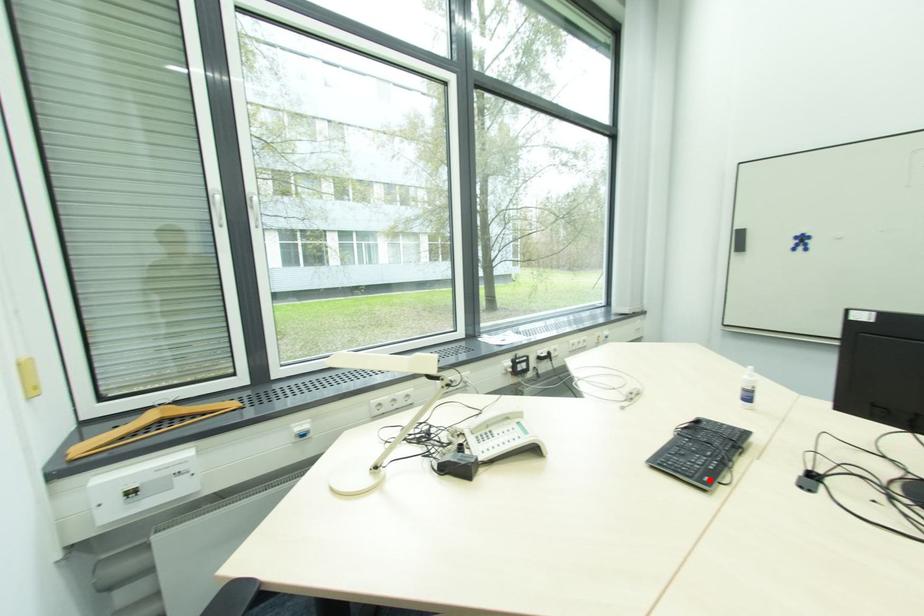
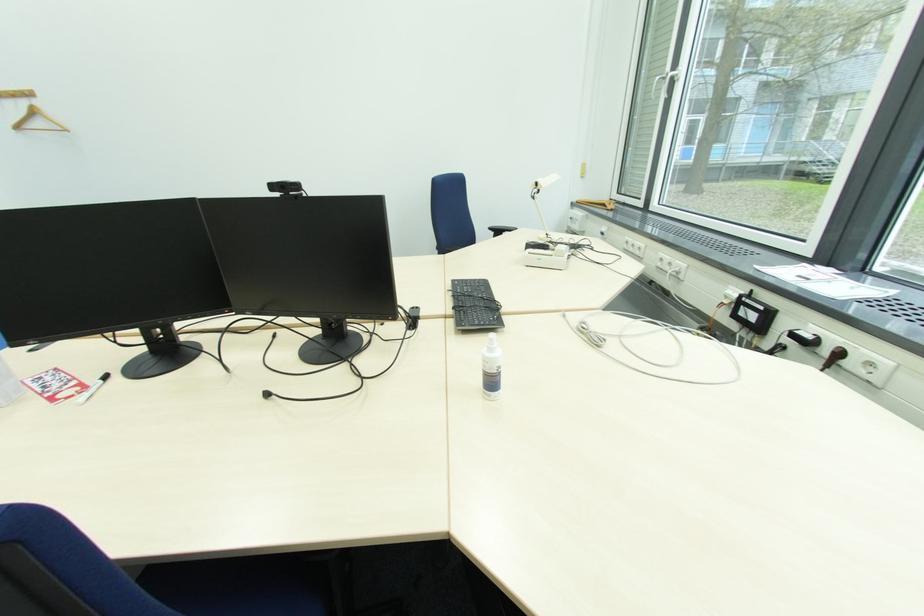
Where in the second image is the point corresponding to the highlighted location from the first image?

(459, 285)